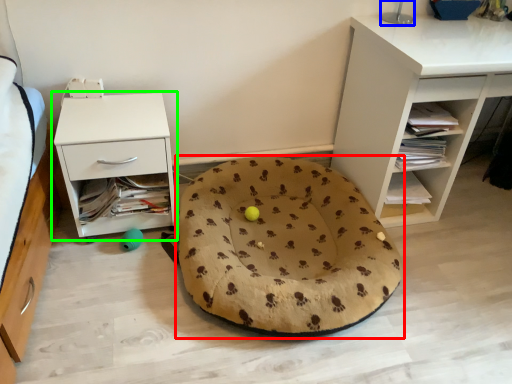
Question: Estimate the real-world distances between objects in this image. Which object is farther from dog bed (highlighted by a red box), table lamp (highlighted by a blue box) or nightstand (highlighted by a green box)?

Choices:
 (A) table lamp
 (B) nightstand

Answer: (A)